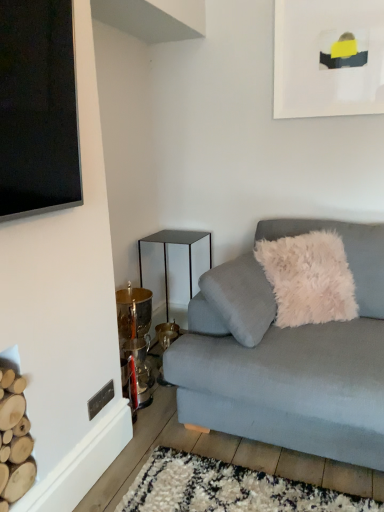
Question: From a real-world perspective, is light gray fabric couch at lower right below metallic/glossy side table at center-left?

Choices:
 (A) no
 (B) yes

Answer: (A)

Question: Is light gray fabric couch at lower right bigger than metallic/glossy side table at center-left?

Choices:
 (A) yes
 (B) no

Answer: (A)

Question: From the image's perspective, is light gray fabric couch at lower right located beneath metallic/glossy side table at center-left?

Choices:
 (A) no
 (B) yes

Answer: (B)

Question: Does light gray fabric couch at lower right contain metallic/glossy side table at center-left?

Choices:
 (A) no
 (B) yes

Answer: (A)

Question: Is light gray fabric couch at lower right next to metallic/glossy side table at center-left?

Choices:
 (A) yes
 (B) no

Answer: (B)

Question: Is light gray fabric couch at lower right outside metallic/glossy side table at center-left?

Choices:
 (A) no
 (B) yes

Answer: (B)

Question: Is the position of metallic/glossy side table at center-left more distant than that of white matte picture frame at upper right?

Choices:
 (A) yes
 (B) no

Answer: (A)

Question: From the image's perspective, is metallic/glossy side table at center-left on top of white matte picture frame at upper right?

Choices:
 (A) no
 (B) yes

Answer: (A)

Question: Considering the relative positions of metallic/glossy side table at center-left and white matte picture frame at upper right in the image provided, is metallic/glossy side table at center-left to the right of white matte picture frame at upper right from the viewer's perspective?

Choices:
 (A) yes
 (B) no

Answer: (B)

Question: Is metallic/glossy side table at center-left touching white matte picture frame at upper right?

Choices:
 (A) yes
 (B) no

Answer: (B)

Question: Is the depth of metallic/glossy side table at center-left less than that of white matte picture frame at upper right?

Choices:
 (A) yes
 (B) no

Answer: (B)

Question: Could white matte picture frame at upper right be considered to be inside metallic/glossy side table at center-left?

Choices:
 (A) no
 (B) yes

Answer: (A)

Question: Is metallic/glossy side table at center-left a part of white matte picture frame at upper right?

Choices:
 (A) yes
 (B) no

Answer: (B)